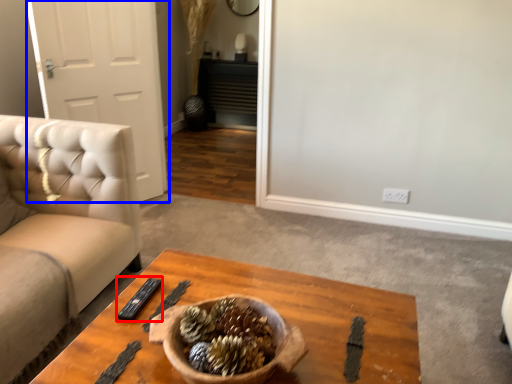
Question: Which object is further to the camera taking this photo, remote (highlighted by a red box) or door (highlighted by a blue box)?

Choices:
 (A) remote
 (B) door

Answer: (B)